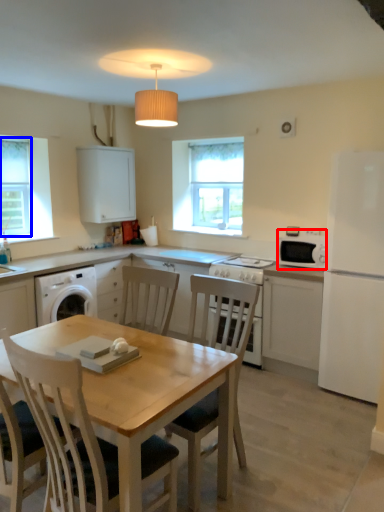
Question: Which point is closer to the camera, microwave oven (highlighted by a red box) or window screen (highlighted by a blue box)?

Choices:
 (A) microwave oven
 (B) window screen

Answer: (A)